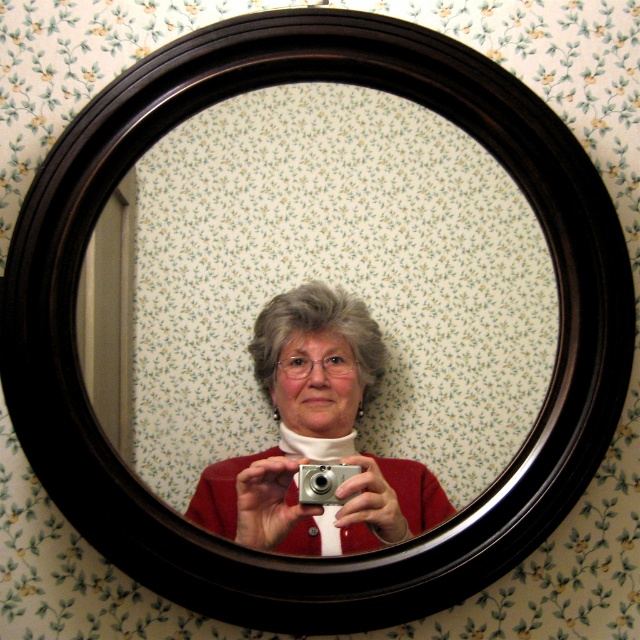
Question: Can you confirm if black wood mirror at center is positioned below matte silver camera at center?

Choices:
 (A) yes
 (B) no

Answer: (B)

Question: Can you confirm if matte silver camera at center is wider than silver metallic camera at center?

Choices:
 (A) no
 (B) yes

Answer: (B)

Question: Which object appears closest to the camera in this image?

Choices:
 (A) black wood mirror at center
 (B) matte silver camera at center

Answer: (B)

Question: Is black wood mirror at center bigger than matte silver camera at center?

Choices:
 (A) yes
 (B) no

Answer: (A)

Question: Which of the following is the farthest from the observer?

Choices:
 (A) (355, 468)
 (B) (324, 346)
 (C) (154, 204)

Answer: (B)

Question: Estimate the real-world distances between objects in this image. Which object is farther from the silver metallic camera at center?

Choices:
 (A) black wood mirror at center
 (B) matte silver camera at center

Answer: (A)